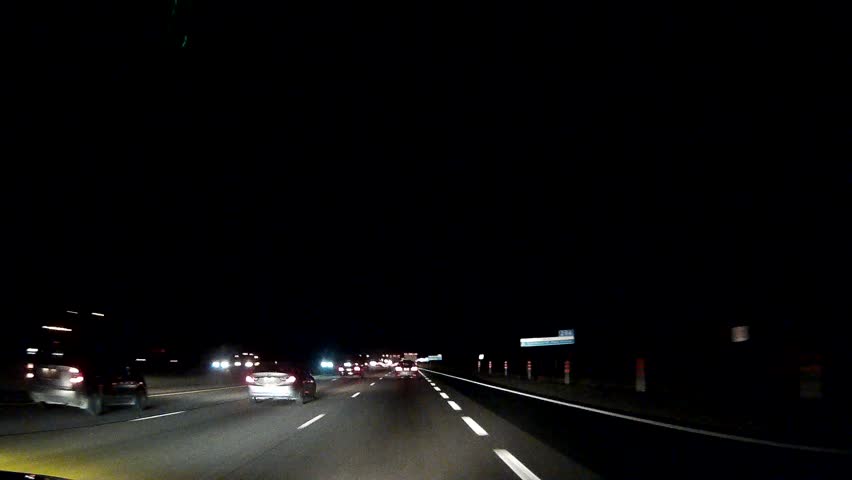
Locate an element on the screen. The image size is (852, 480). glare of lights is located at coordinates (331, 362), (216, 367), (381, 363).